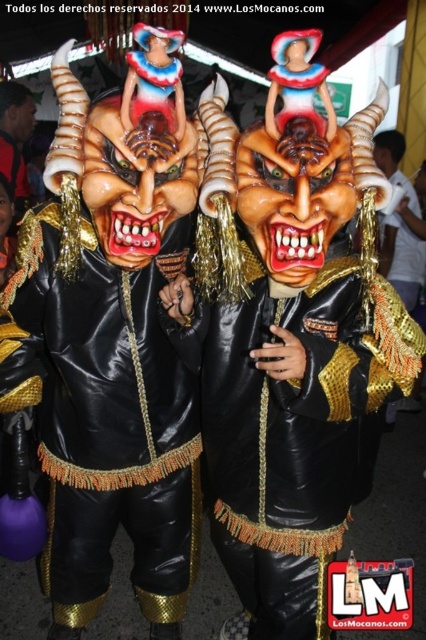
From the picture: You are standing in front of the two individuals in the image. You want to place a small decoration on the point closer to you. Which point should you choose between the point at coordinates point (83, 484) and point (273, 504)?

You should choose the point at coordinates point (83, 484) because it is closer to you than the point at coordinates point (273, 504).

You are standing in front of the image. If you were to draw a crosshair at the center of the image, would the black leather mask at center be to the left or right of the crosshair?

The black leather mask at center is located at point 0.653 on the x axis, which is to the right of the center crosshair at 0.5. Therefore, the black leather mask at center is to the right of the crosshair.